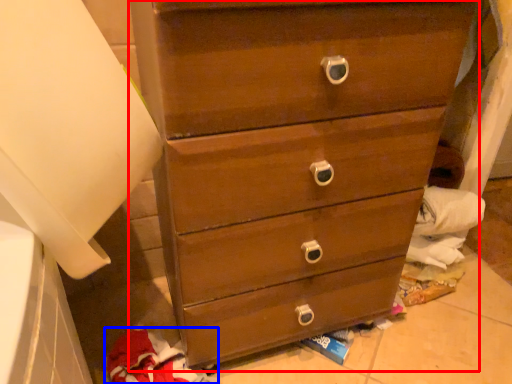
Question: Which object is closer to the camera taking this photo, chest of drawers (highlighted by a red box) or clothing (highlighted by a blue box)?

Choices:
 (A) chest of drawers
 (B) clothing

Answer: (A)